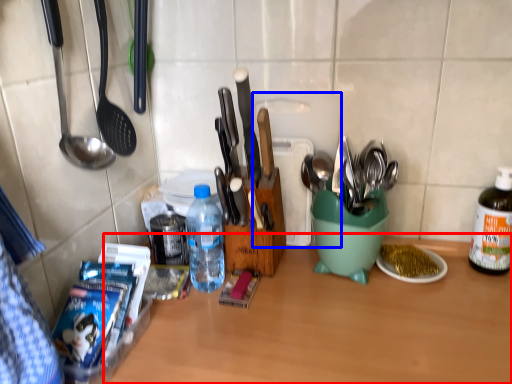
Question: Which object appears farthest to the camera in this image, table (highlighted by a red box) or cutting board (highlighted by a blue box)?

Choices:
 (A) table
 (B) cutting board

Answer: (B)